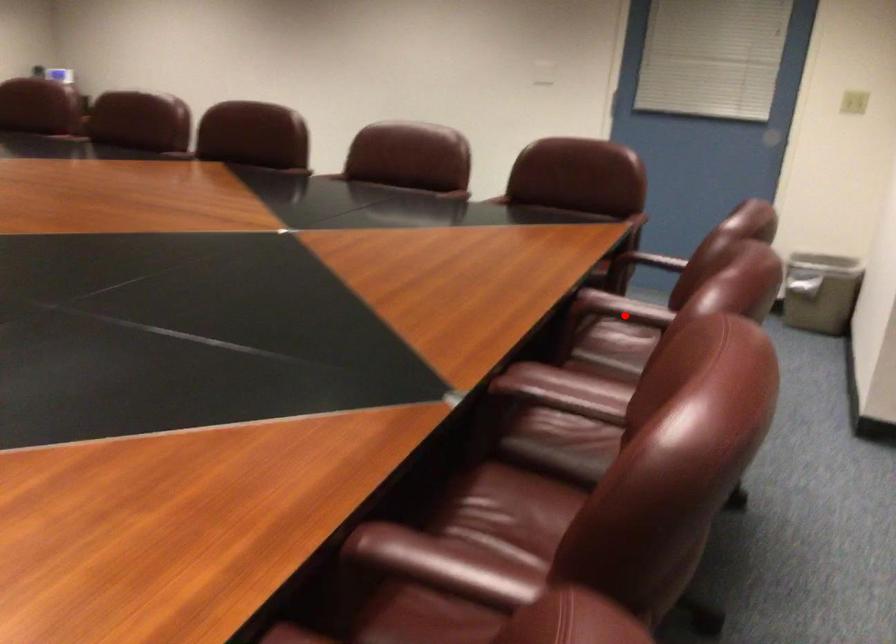
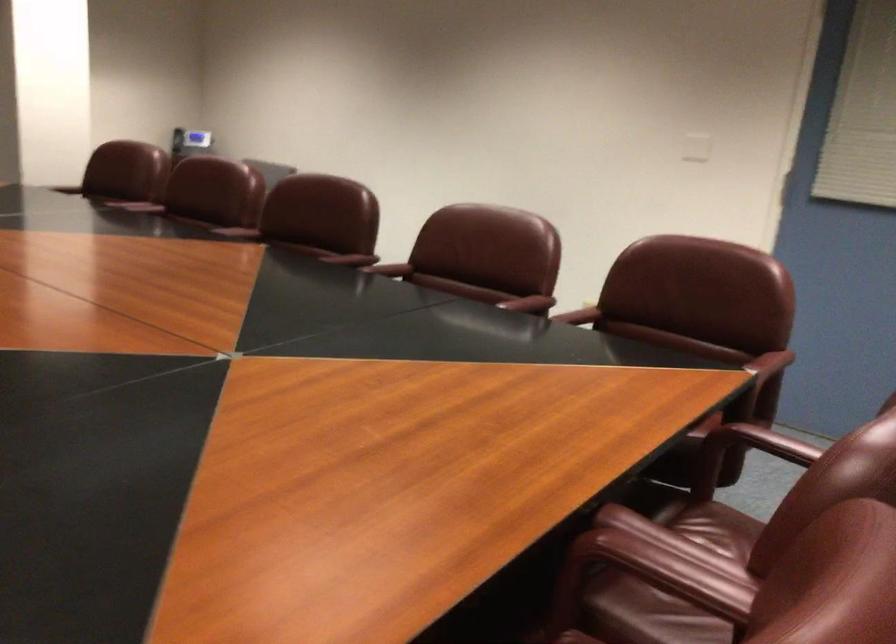
Find the pixel in the second image that matches the highlighted location in the first image.

(657, 573)